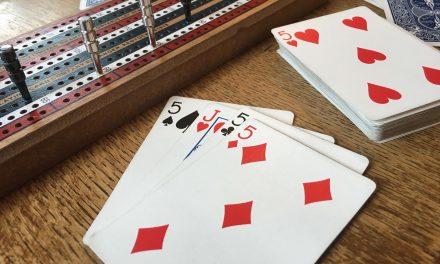
At what (x,y) coordinates should I click in order to perform the action: click on table game. Please return your answer as a coordinate pair (x, y). Looking at the image, I should click on (77, 99).